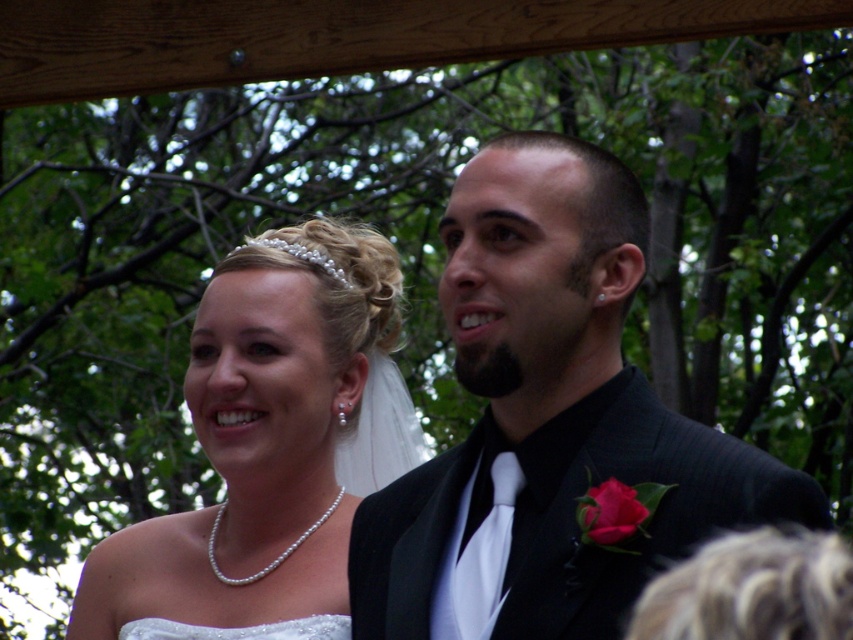
Question: Estimate the real-world distances between objects in this image. Which object is closer to the pearl necklace at upper left?

Choices:
 (A) shiny black suit at center
 (B) matte pink rose at lower right
 (C) white satin dress at lower left

Answer: (C)

Question: Can you confirm if shiny black suit at center is smaller than pearl necklace at upper left?

Choices:
 (A) yes
 (B) no

Answer: (A)

Question: Can you confirm if shiny black suit at center is positioned below pearl necklace at upper left?

Choices:
 (A) yes
 (B) no

Answer: (B)

Question: Is shiny black suit at center below matte pink rose at lower right?

Choices:
 (A) yes
 (B) no

Answer: (B)

Question: Which point appears closest to the camera in this image?

Choices:
 (A) (642, 506)
 (B) (300, 337)
 (C) (314, 637)
 (D) (422, 618)

Answer: (A)

Question: Which object is positioned closest to the white satin dress at lower left?

Choices:
 (A) pearl necklace at upper left
 (B) matte pink rose at lower right
 (C) shiny black suit at center

Answer: (A)